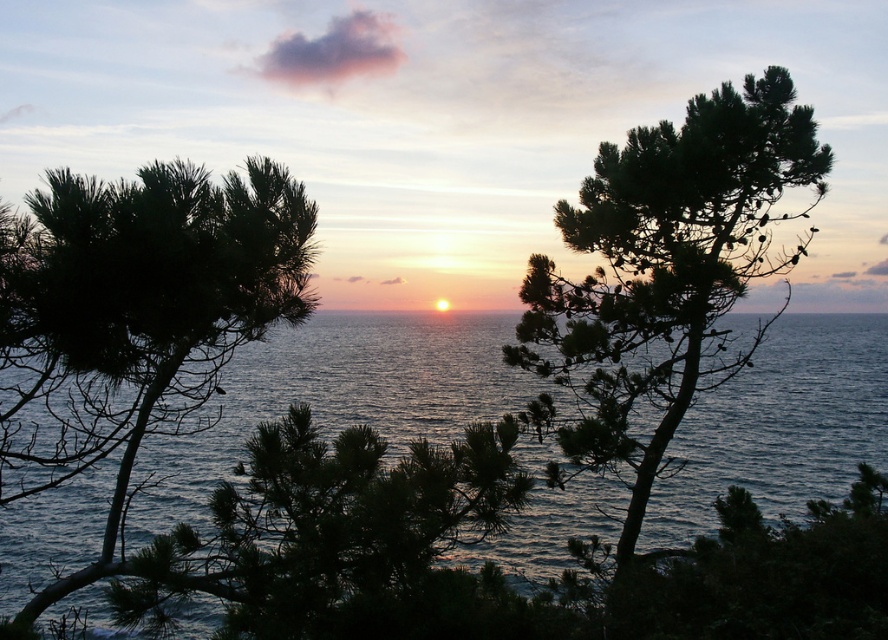
Question: Which point is farther to the camera?

Choices:
 (A) dark green textured tree at upper right
 (B) dark green pine tree at center
 (C) dark green pine tree at left
 (D) blue water at center

Answer: (A)

Question: Can you confirm if blue water at center is bigger than dark green textured tree at upper right?

Choices:
 (A) no
 (B) yes

Answer: (B)

Question: Can you confirm if blue water at center is positioned above dark green textured tree at upper right?

Choices:
 (A) yes
 (B) no

Answer: (B)

Question: Based on their relative distances, which object is farther from the dark green pine tree at center?

Choices:
 (A) dark green pine tree at left
 (B) blue water at center
 (C) dark green textured tree at upper right

Answer: (B)

Question: Which point is farther to the camera?

Choices:
 (A) dark green pine tree at left
 (B) dark green textured tree at upper right
 (C) dark green pine tree at center
 (D) blue water at center

Answer: (B)

Question: Does dark green pine tree at left lie behind dark green pine tree at center?

Choices:
 (A) no
 (B) yes

Answer: (B)